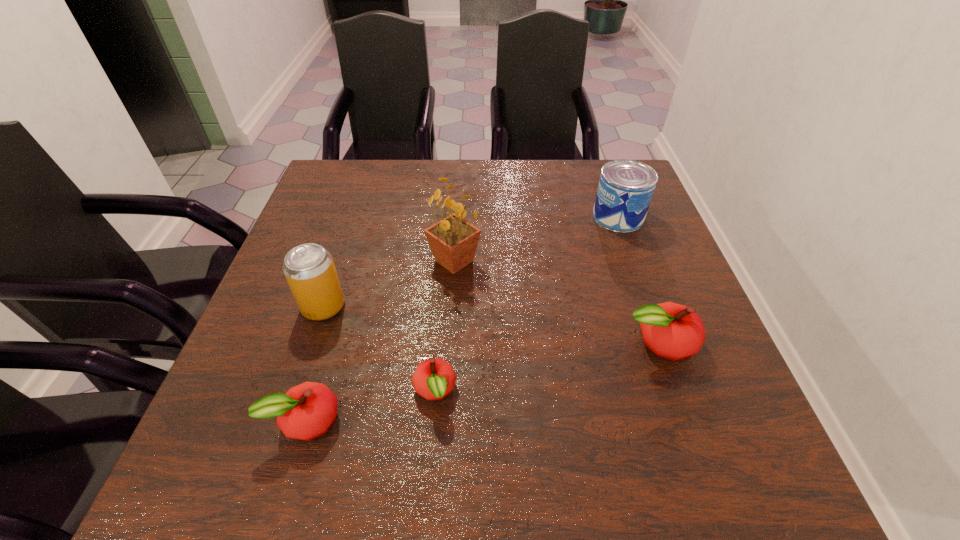
Where is `vacant area situated on the back of the second shortest apple`? vacant area situated on the back of the second shortest apple is located at coordinates (330, 337).

In order to click on free space located on the left of the second apple from right to left in this screenshot , I will do `click(265, 392)`.

Find the location of `vacant space situated 0.360m on the back of the rightmost apple`. vacant space situated 0.360m on the back of the rightmost apple is located at coordinates (613, 215).

Find the location of a particular element. Image resolution: width=960 pixels, height=540 pixels. blank area located 0.190m at the front of the tallest object with flowers visible is located at coordinates (449, 349).

I want to click on vacant area located on the front of the pop (soda), so click(x=294, y=396).

The height and width of the screenshot is (540, 960). Identify the location of vacant area situated on the front label of the can. click(x=454, y=217).

I want to click on free point located on the front label of the can, so click(443, 217).

Locate an element on the screen. The height and width of the screenshot is (540, 960). free space located on the front label of the can is located at coordinates (533, 217).

Find the location of a particular element. object that is at the far edge is located at coordinates (625, 189).

This screenshot has height=540, width=960. What are the coordinates of `apple that is at the left edge` in the screenshot? It's located at (306, 411).